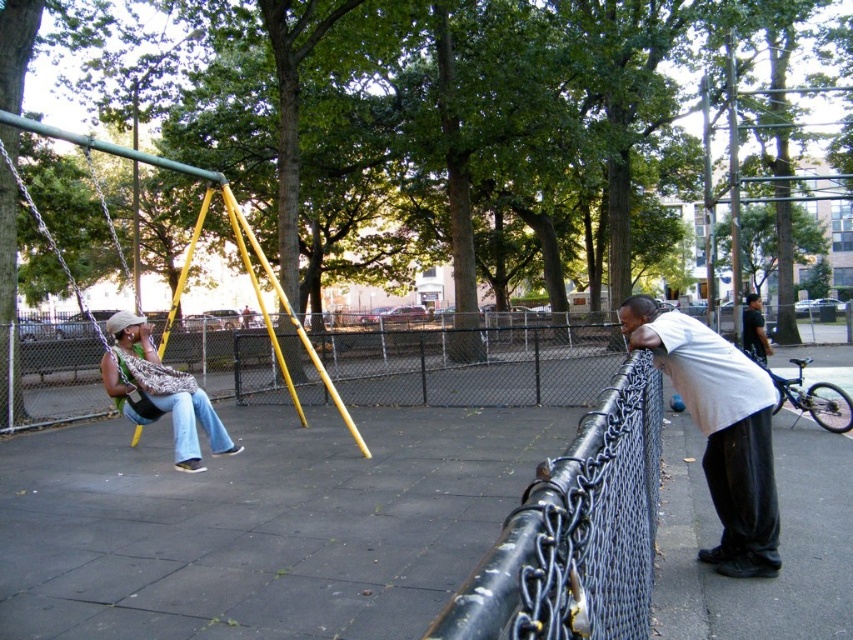
Question: Which point is farther from the camera taking this photo?

Choices:
 (A) (688, 321)
 (B) (776, 374)
 (C) (105, 348)

Answer: (B)

Question: Does black matte bicycle at right have a larger size compared to matte black swing at left?

Choices:
 (A) yes
 (B) no

Answer: (B)

Question: Which point is closer to the camera taking this photo?

Choices:
 (A) (769, 374)
 (B) (171, 404)

Answer: (A)

Question: Observing the image, what is the correct spatial positioning of white matte shirt at right in reference to matte black swing at left?

Choices:
 (A) left
 (B) right

Answer: (B)

Question: Which object appears closest to the camera in this image?

Choices:
 (A) dark green shirt at right
 (B) matte green swing at left

Answer: (B)

Question: Does white matte shirt at right appear over black matte bicycle at right?

Choices:
 (A) no
 (B) yes

Answer: (B)